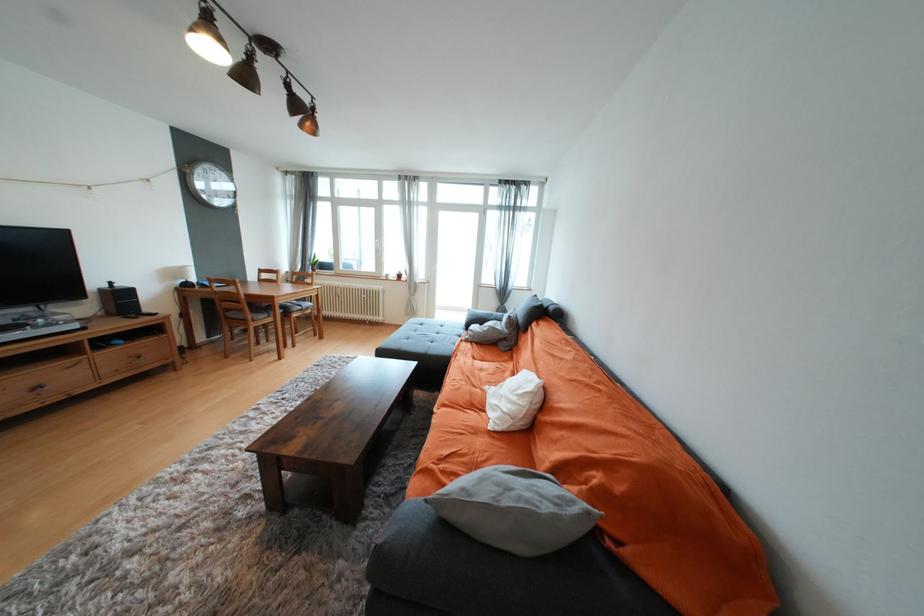
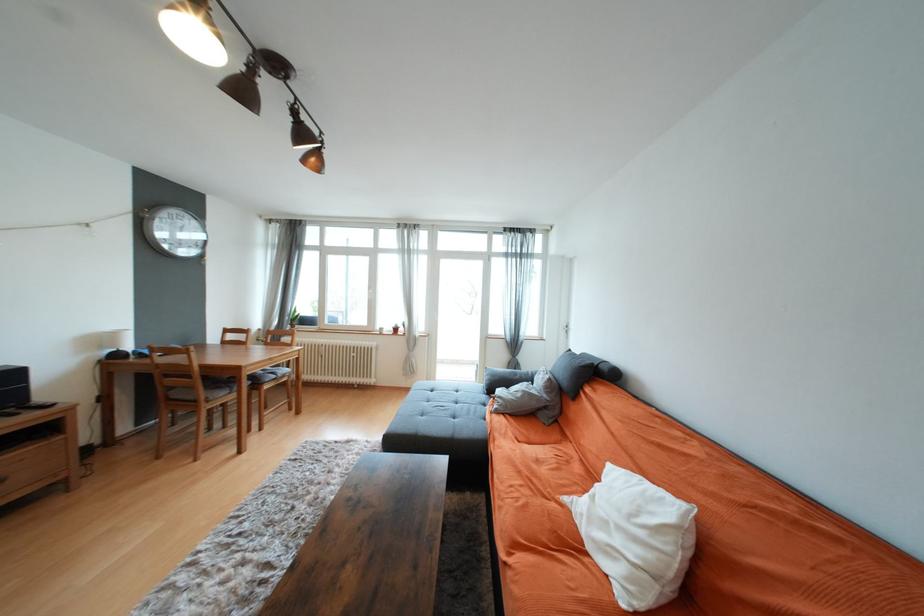
Which direction would the cameraman need to move to produce the second image?

The cameraman moved toward left, forward.